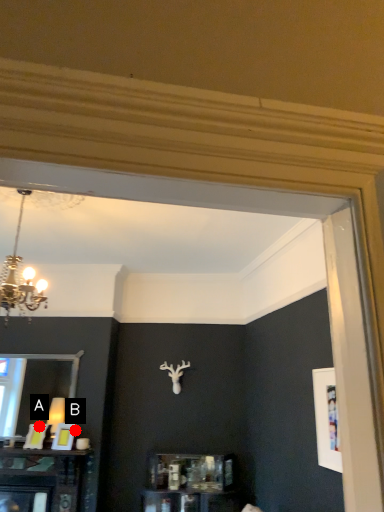
Question: Two points are circled on the image, labeled by A and B beside each circle. Which point is closer to the camera?

Choices:
 (A) A is closer
 (B) B is closer

Answer: (B)